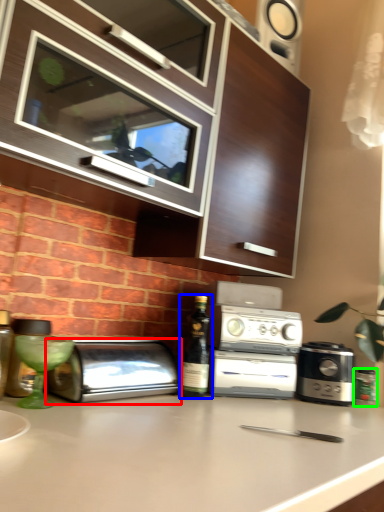
Question: Which object is positioned farthest from toaster (highlighted by a red box)? Select from wine bottle (highlighted by a blue box) and bottle (highlighted by a green box).

Choices:
 (A) wine bottle
 (B) bottle

Answer: (B)